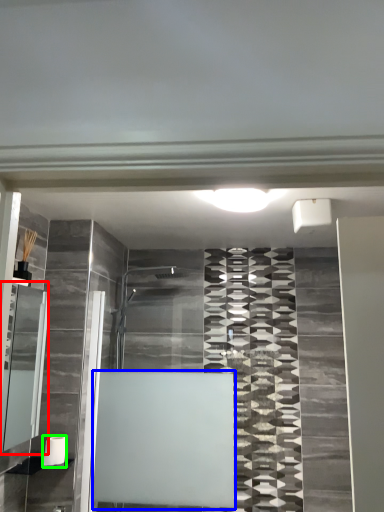
Question: Which is farther away from cabinet (highlighted by a red box)? bath (highlighted by a blue box) or toilet paper (highlighted by a green box)?

Choices:
 (A) bath
 (B) toilet paper

Answer: (A)